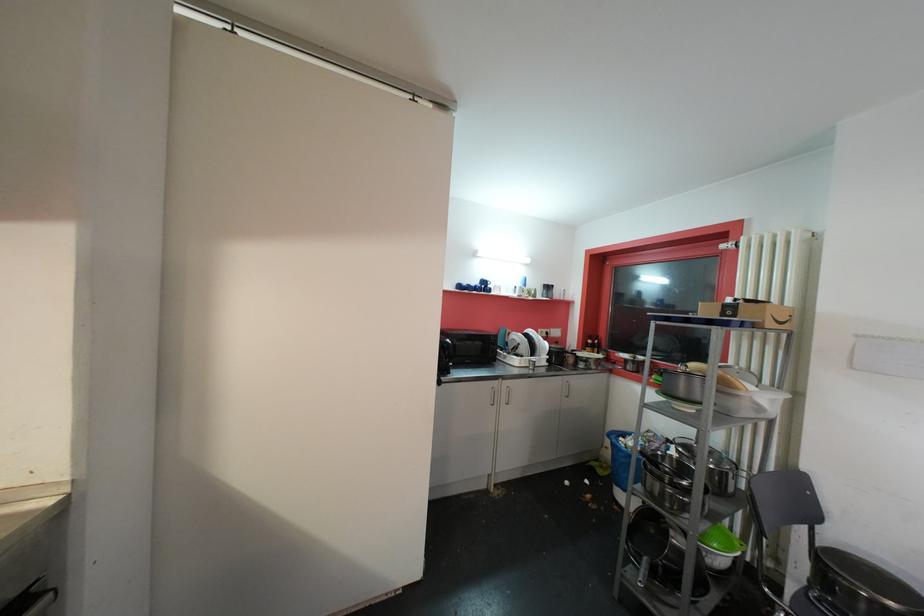
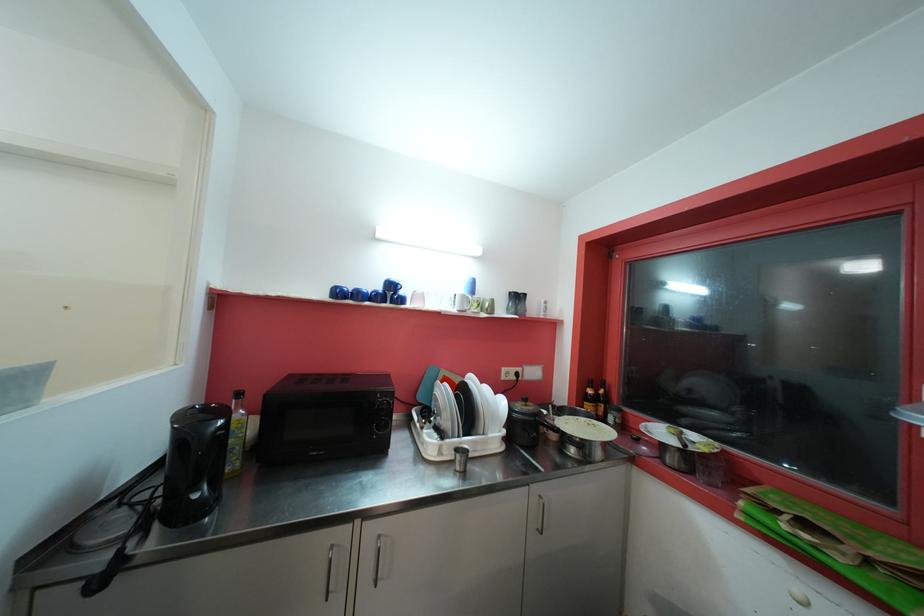
The point at (465, 289) is marked in the first image. Where is the corresponding point in the second image?

(343, 294)